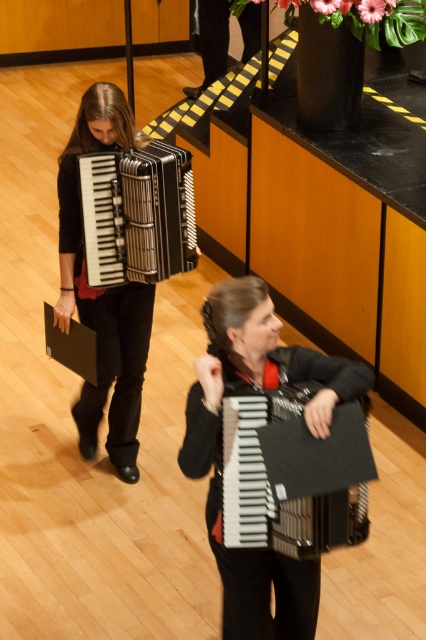
Does point (216, 396) come closer to viewer compared to point (302, 420)?

Yes, point (216, 396) is in front of point (302, 420).

Where is `matte black accordion at center`? Image resolution: width=426 pixels, height=640 pixels. matte black accordion at center is located at coordinates (256, 369).

Does matte black accordion at left have a lesser height compared to metallic silver accordion at center?

Incorrect, matte black accordion at left's height does not fall short of metallic silver accordion at center's.

Which of these two, matte black accordion at left or metallic silver accordion at center, stands shorter?

metallic silver accordion at center

Is point (69, 317) farther from viewer compared to point (123, 193)?

Yes, point (69, 317) is farther from viewer.

Locate an element on the screen. matte black accordion at left is located at coordinates (103, 291).

Between matte black accordion at center and metallic silver accordion at center, which one appears on the left side from the viewer's perspective?

Positioned to the left is metallic silver accordion at center.

Who is lower down, matte black accordion at center or metallic silver accordion at center?

matte black accordion at center is below.

Find the location of a particular element. Image resolution: width=426 pixels, height=640 pixels. matte black accordion at center is located at coordinates (256, 369).

Where is `matte black accordion at center`? matte black accordion at center is located at coordinates (256, 369).